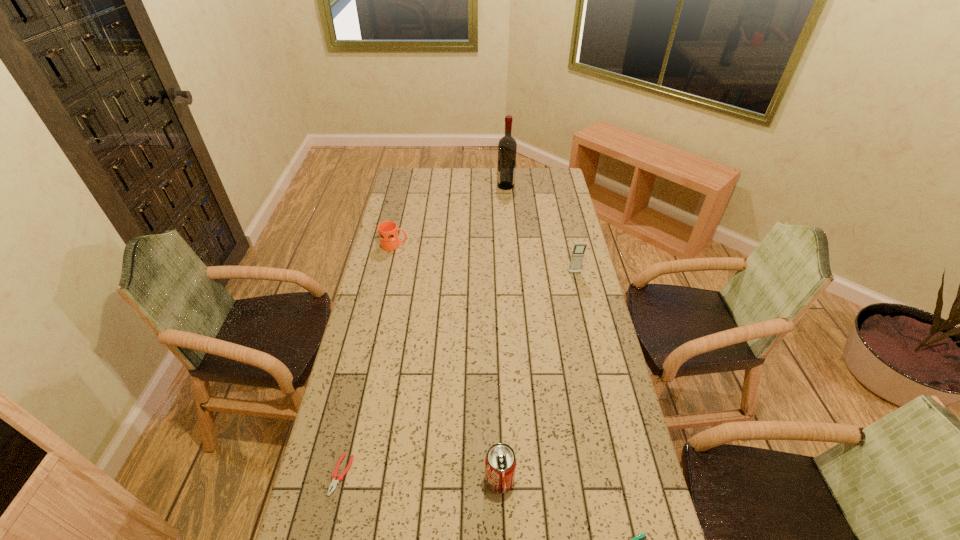
Locate an element on the screen. free spot between the left pliers and the third tallest object is located at coordinates (420, 477).

This screenshot has width=960, height=540. In order to click on free space between the fourth tallest object and the third tallest object in this screenshot , I will do `click(447, 362)`.

The height and width of the screenshot is (540, 960). I want to click on the closest object to the nearest object, so click(500, 462).

Locate which object ranks third in proximity to the fourth tallest object. Please provide its 2D coordinates. Your answer should be formatted as a tuple, i.e. [(x, y)], where the tuple contains the x and y coordinates of a point satisfying the conditions above.

[(335, 476)]

Identify the location of free space in the image that satisfies the following two spatial constraints: 1. on the handle side of the fourth tallest object; 2. on the right side of the pop soda. The image size is (960, 540). coord(342,480).

Where is `vacant space that satisfies the following two spatial constraints: 1. on the handle side of the third shortest object; 2. on the front side of the left pliers`? Image resolution: width=960 pixels, height=540 pixels. vacant space that satisfies the following two spatial constraints: 1. on the handle side of the third shortest object; 2. on the front side of the left pliers is located at coordinates (343, 475).

What are the coordinates of `vacant area that satisfies the following two spatial constraints: 1. on the handle side of the fourth tallest object; 2. on the right side of the pop soda` in the screenshot? It's located at pos(342,480).

This screenshot has height=540, width=960. Identify the location of vacant region that satisfies the following two spatial constraints: 1. on the handle side of the pop soda; 2. on the right side of the mug. (342, 480).

The height and width of the screenshot is (540, 960). In order to click on vacant area in the image that satisfies the following two spatial constraints: 1. on the front and back of the alcohol; 2. on the front side of the fourth shortest object in this screenshot , I will do `click(529, 480)`.